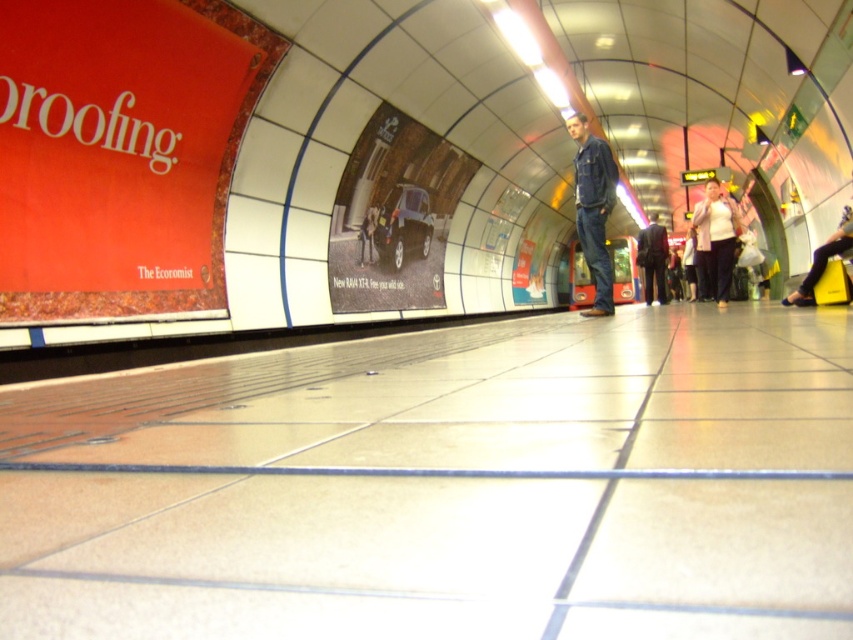
Who is more distant from viewer, (724, 225) or (643, 241)?

Positioned behind is point (643, 241).

Is white textured sweater at right to the right of dark brown suit at center from the viewer's perspective?

Incorrect, white textured sweater at right is not on the right side of dark brown suit at center.

Is point (728, 266) closer to camera compared to point (660, 227)?

Yes.

This screenshot has height=640, width=853. I want to click on white textured sweater at right, so click(x=717, y=237).

This screenshot has width=853, height=640. I want to click on denim jacket at center, so click(x=593, y=208).

Where is `denim jacket at center`? denim jacket at center is located at coordinates (593, 208).

Between denim jacket at center and dark brown suit at center, which one appears on the left side from the viewer's perspective?

denim jacket at center

Which of these two, denim jacket at center or dark brown suit at center, stands shorter?

With less height is dark brown suit at center.

Which is behind, point (602, 240) or point (653, 275)?

Positioned behind is point (653, 275).

Where is `denim jacket at center`? denim jacket at center is located at coordinates (593, 208).